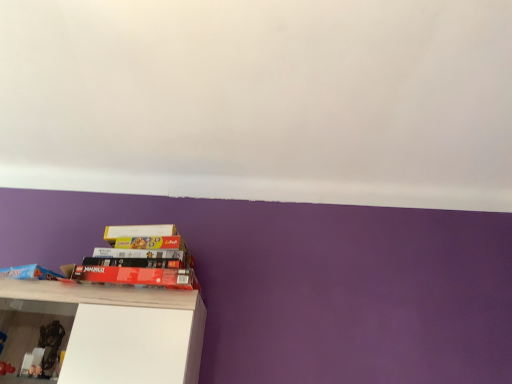
Question: Is the surface of matte blue book at lower left, the second book in the right-to-left sequence, in direct contact with white glossy shelf at lower left?

Choices:
 (A) no
 (B) yes

Answer: (A)

Question: Is the depth of matte blue book at lower left, which ranks as the first book in left-to-right order, less than that of white glossy shelf at lower left?

Choices:
 (A) yes
 (B) no

Answer: (B)

Question: Is matte blue book at lower left, the second book in the right-to-left sequence, oriented towards white glossy shelf at lower left?

Choices:
 (A) yes
 (B) no

Answer: (B)

Question: Is matte blue book at lower left, the second book in the right-to-left sequence, positioned with its back to white glossy shelf at lower left?

Choices:
 (A) no
 (B) yes

Answer: (A)

Question: From a real-world perspective, is matte blue book at lower left, the second book in the right-to-left sequence, located higher than white glossy shelf at lower left?

Choices:
 (A) yes
 (B) no

Answer: (A)

Question: Does matte blue book at lower left, which ranks as the first book in left-to-right order, have a lesser height compared to white glossy shelf at lower left?

Choices:
 (A) yes
 (B) no

Answer: (A)

Question: From the image's perspective, is white glossy shelf at lower left beneath matte blue book at lower left, which ranks as the first book in left-to-right order?

Choices:
 (A) no
 (B) yes

Answer: (B)

Question: Can we say white glossy shelf at lower left lies outside matte blue book at lower left, which ranks as the first book in left-to-right order?

Choices:
 (A) yes
 (B) no

Answer: (A)

Question: Is white glossy shelf at lower left positioned before matte blue book at lower left, the second book in the right-to-left sequence?

Choices:
 (A) no
 (B) yes

Answer: (B)

Question: From a real-world perspective, is white glossy shelf at lower left positioned over matte blue book at lower left, which ranks as the first book in left-to-right order, based on gravity?

Choices:
 (A) yes
 (B) no

Answer: (B)

Question: From a real-world perspective, is white glossy shelf at lower left below matte blue book at lower left, the second book in the right-to-left sequence?

Choices:
 (A) yes
 (B) no

Answer: (A)

Question: Does white glossy shelf at lower left contain matte blue book at lower left, the second book in the right-to-left sequence?

Choices:
 (A) yes
 (B) no

Answer: (B)

Question: Is matte black book at lower left, which is counted as the first book, starting from the right, next to matte blue book at lower left, which ranks as the first book in left-to-right order, and touching it?

Choices:
 (A) no
 (B) yes

Answer: (A)